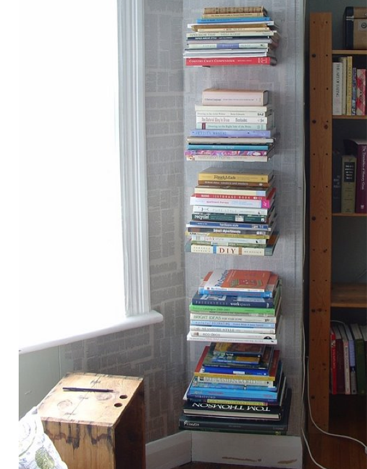
The image size is (367, 469). Identify the location of base of windwo frame. (51, 339).